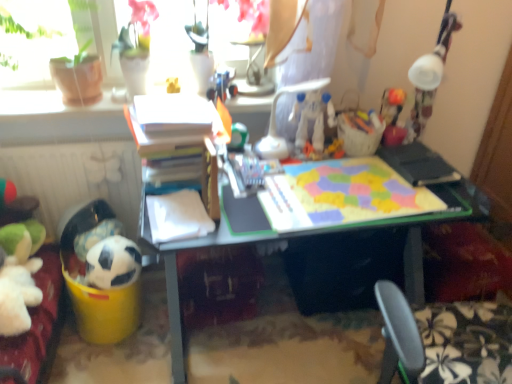
Question: Is yellow matte toy at upper center, marked as the 2th toy in a left-to-right arrangement, spatially inside white matte soccer ball at lower left, the first toy ordered from the bottom, or outside of it?

Choices:
 (A) outside
 (B) inside

Answer: (A)

Question: Relative to white matte soccer ball at lower left, which is the first toy in left-to-right order, is yellow matte toy at upper center, marked as the 2th toy in a left-to-right arrangement, in front or behind?

Choices:
 (A) front
 (B) behind

Answer: (B)

Question: Estimate the real-world distances between objects in this image. Which object is farther from the white matte radiator at lower left?

Choices:
 (A) yellow matte toy at upper center, which ranks as the 1th toy in top-to-bottom order
 (B) matte plastic desk at center
 (C) white matte soccer ball at lower left, which is the first toy in left-to-right order
 (D) white matte soccer ball at lower left
 (E) green matte ball at center, positioned as the 3th toy in top-to-bottom order

Answer: (E)

Question: Which of these objects is positioned farthest from the white plastic robot at center, marked as the second toy in a top-to-bottom arrangement?

Choices:
 (A) white matte soccer ball at lower left
 (B) white plastic chair at center
 (C) white matte soccer ball at lower left, the fourth toy positioned from the top
 (D) matte plastic desk at center
 (E) green matte ball at center, which ranks as the 2th toy in bottom-to-top order

Answer: (C)